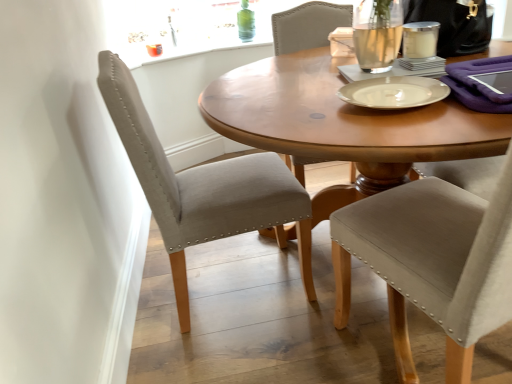
Identify the location of free point below satin beige chair at left, the second chair viewed from the right (from a real-world perspective). (239, 288).